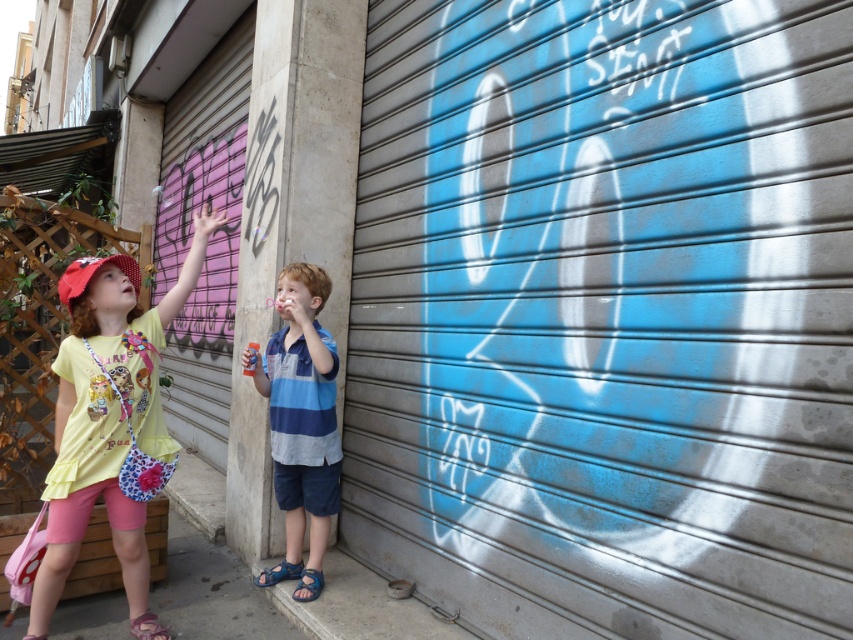
You are a delivery person with a box that is 1.5 meters wide. You need to deliver it to the address shown in the image. Can you fit the box through the space between the metallic silver garage door at center and the yellow fabric shirt at upper left?

The metallic silver garage door at center is 1.46 meters from the yellow fabric shirt at upper left. Since the box is 1.5 meters wide, it is slightly wider than the available space, so the box cannot fit through the space between them.

You are a photographer trying to capture both the yellow fabric shirt at upper left and the blue striped shirt at center in a single frame. Since the shirts are different in size, which one should you focus on to ensure both are clearly visible in your photo?

The yellow fabric shirt at upper left is larger in size than the blue striped shirt at center, so focusing on the larger yellow fabric shirt at upper left will help ensure both shirts are clearly visible in the photo.